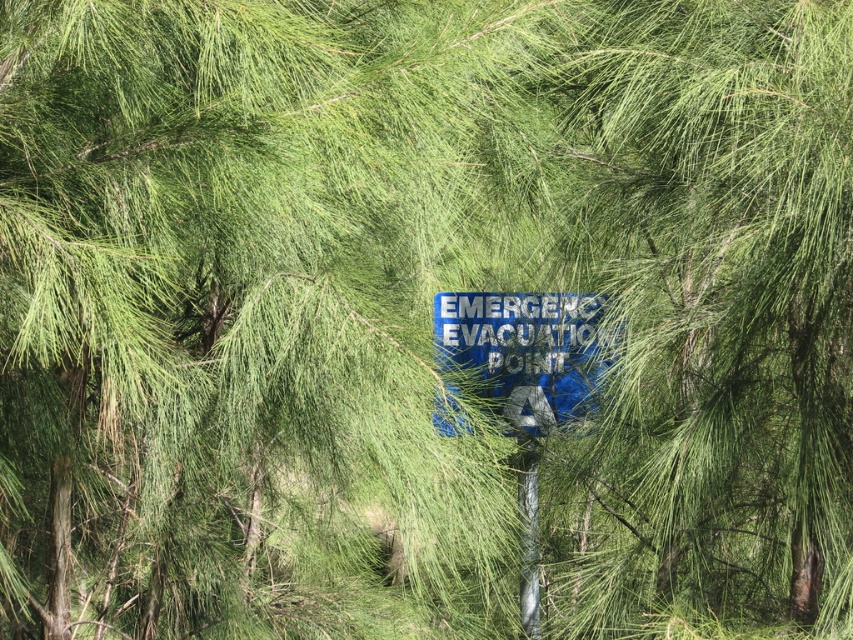
Question: In this image, where is blue plastic sign at center located relative to metallic silver pole at center?

Choices:
 (A) below
 (B) above

Answer: (B)

Question: Can you confirm if blue plastic sign at center is positioned to the left of metallic silver pole at center?

Choices:
 (A) no
 (B) yes

Answer: (A)

Question: Does blue plastic sign at center appear over metallic silver pole at center?

Choices:
 (A) no
 (B) yes

Answer: (B)

Question: Which point is closer to the camera?

Choices:
 (A) metallic silver pole at center
 (B) blue plastic sign at center

Answer: (B)